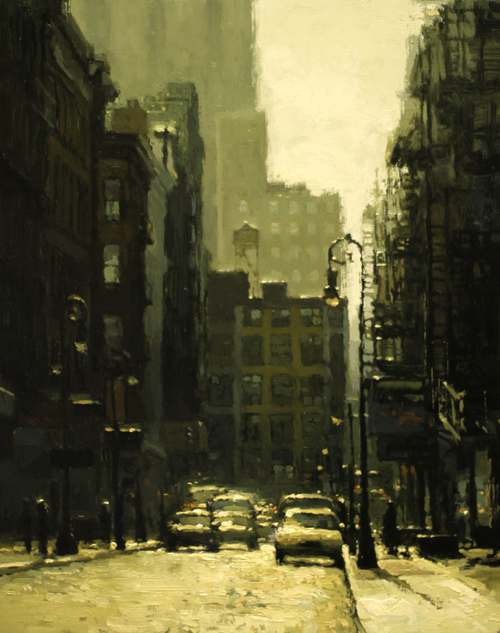
Where is `windows`? This screenshot has height=633, width=500. windows is located at coordinates (250, 372), (275, 435), (291, 398), (289, 364).